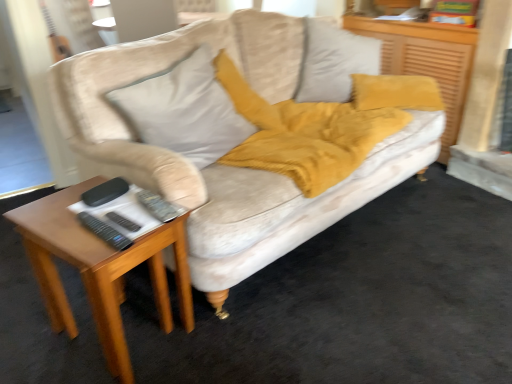
At what (x,y) coordinates should I click in order to perform the action: click on empty space that is to the right of woodenmaterial/texturetable at left. Please return your answer as a coordinate pair (x, y). The width and height of the screenshot is (512, 384). Looking at the image, I should click on (227, 340).